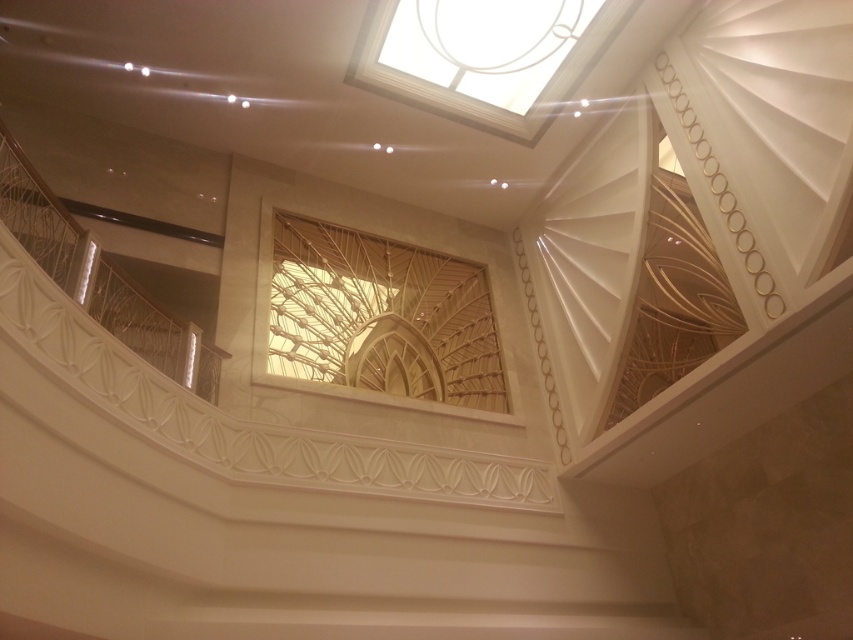
You are an interior designer planning to install a new lighting fixture. You have two options based on the image. The translucent wood lattice at center and the transparent glass skylight at upper center. Which object would allow more natural light into the space, and why?

The transparent glass skylight at upper center allows more natural light into the space because it is made of transparent glass, which lets light pass through more effectively than the translucent wood lattice at center, which diffuses and reduces the amount of light passing through.

You are an interior designer planning to install a new decorative element in the space. You have two options for placement between the translucent wood lattice at center and the transparent glass skylight at upper center. Which of these two objects is narrower in width?

The translucent wood lattice at center is thinner than the transparent glass skylight at upper center, so the translucent wood lattice at center is narrower in width.